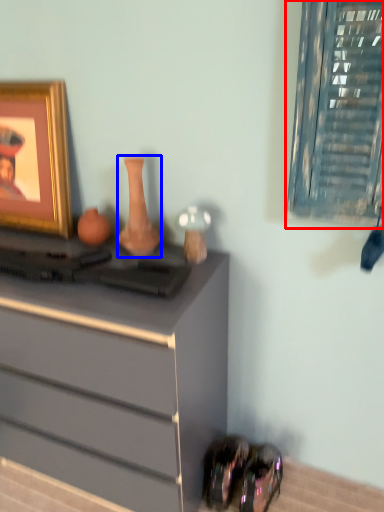
Question: Which object appears farthest to the camera in this image, window (highlighted by a red box) or vase (highlighted by a blue box)?

Choices:
 (A) window
 (B) vase

Answer: (B)